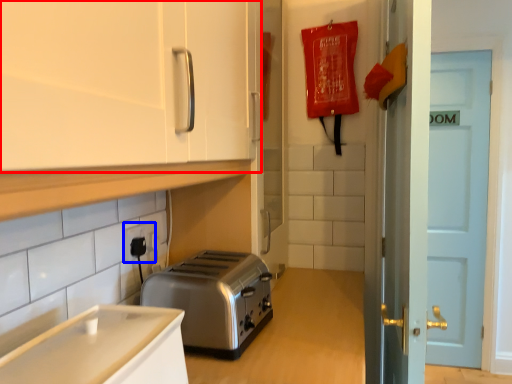
Question: Which point is further to the camera, cabinetry (highlighted by a red box) or electric outlet (highlighted by a blue box)?

Choices:
 (A) cabinetry
 (B) electric outlet

Answer: (B)